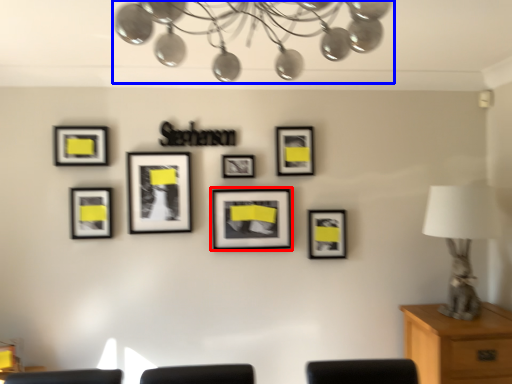
Question: Among these objects, which one is nearest to the camera, picture frame (highlighted by a red box) or lamp (highlighted by a blue box)?

Choices:
 (A) picture frame
 (B) lamp

Answer: (B)